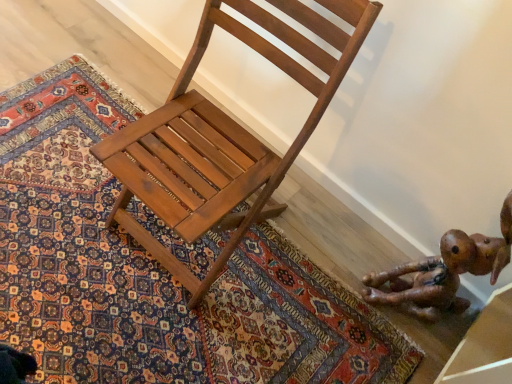
Image resolution: width=512 pixels, height=384 pixels. Find the location of `vacant region under carpeted rug at center (from a real-world perspective)`. vacant region under carpeted rug at center (from a real-world perspective) is located at coordinates (125, 254).